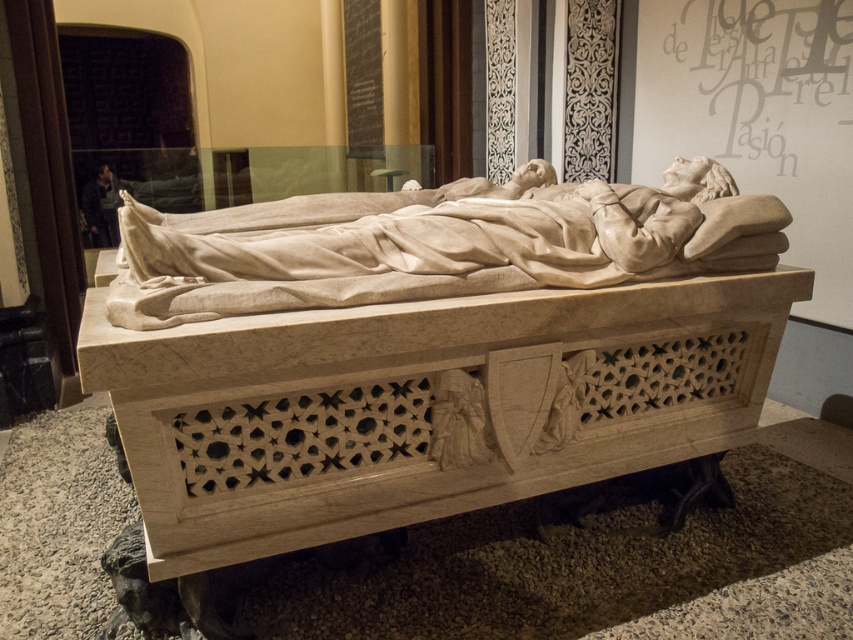
Between white marble sarcophagus at center and matte gray text at upper center, which one is positioned higher?

Positioned higher is matte gray text at upper center.

Is white marble sarcophagus at center to the right of matte gray text at upper center from the viewer's perspective?

In fact, white marble sarcophagus at center is to the left of matte gray text at upper center.

Between point (439, 326) and point (769, 144), which one is positioned behind?

The point (769, 144) is more distant.

Identify the location of white marble sarcophagus at center. The width and height of the screenshot is (853, 640). point(438,358).

Which of these two, white marble sarcophagus at center or white marble statue at center, stands taller?

white marble sarcophagus at center

Between point (637, 291) and point (532, 180), which one is positioned in front?

Point (637, 291)

Who is more distant from viewer, [122,420] or [508,248]?

Point [508,248]

Identify the location of white marble sarcophagus at center. (438, 358).

Does white marble statue at center have a smaller size compared to matte gray text at upper center?

No, white marble statue at center is not smaller than matte gray text at upper center.

Is white marble statue at center taller than matte gray text at upper center?

Incorrect, white marble statue at center's height is not larger of matte gray text at upper center's.

What do you see at coordinates (436, 243) in the screenshot? This screenshot has height=640, width=853. I see `white marble statue at center` at bounding box center [436, 243].

Where is `white marble statue at center`? white marble statue at center is located at coordinates (436, 243).